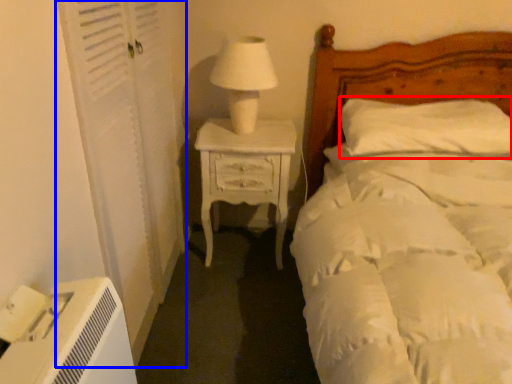
Question: Which of the following is the farthest to the observer, pillow (highlighted by a red box) or screen door (highlighted by a blue box)?

Choices:
 (A) pillow
 (B) screen door

Answer: (A)